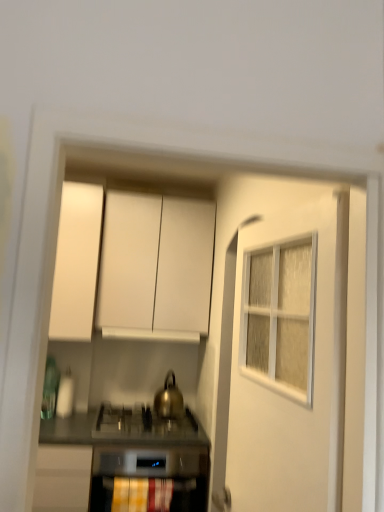
Describe the element at coordinates (76, 262) in the screenshot. This screenshot has height=512, width=384. I see `white matte cabinet at upper left, the 2th cabinetry in the right-to-left sequence` at that location.

This screenshot has height=512, width=384. Identify the location of white matte vent at center. (151, 335).

Image resolution: width=384 pixels, height=512 pixels. Describe the element at coordinates (290, 385) in the screenshot. I see `white textured door at center` at that location.

What do you see at coordinates (169, 399) in the screenshot?
I see `gold metallic kettle at center` at bounding box center [169, 399].

In order to face gold metallic kettle at center, should I rotate leftwards or rightwards?

Turn left by 2.668 degrees to look at gold metallic kettle at center.

Describe the element at coordinates (141, 495) in the screenshot. I see `yellow fabric curtain at lower center` at that location.

At what (x,y) coordinates should I click in order to perform the action: click on white matte cabinet at upper center, the second cabinetry when ordered from left to right. Please return your answer as a coordinate pair (x, y). The width and height of the screenshot is (384, 512). Looking at the image, I should click on (155, 267).

Identify the location of white matte cabinet at upper left, positioned as the first cabinetry in left-to-right order. (76, 262).

Considering the sizes of objects gold metallic kettle at center and white matte cabinet at upper left, positioned as the first cabinetry in left-to-right order, in the image provided, who is shorter, gold metallic kettle at center or white matte cabinet at upper left, positioned as the first cabinetry in left-to-right order,?

Standing shorter between the two is gold metallic kettle at center.

Is gold metallic kettle at center thinner than white matte cabinet at upper left, positioned as the first cabinetry in left-to-right order?

Indeed, gold metallic kettle at center has a lesser width compared to white matte cabinet at upper left, positioned as the first cabinetry in left-to-right order.

How different are the orientations of gold metallic kettle at center and white matte cabinet at upper left, the 2th cabinetry in the right-to-left sequence, in degrees?

They differ by 0.623 degrees in their facing directions.

The width and height of the screenshot is (384, 512). Find the location of `the 2nd cabinetry in front of the gold metallic kettle at center`. the 2nd cabinetry in front of the gold metallic kettle at center is located at coordinates (76, 262).

Looking at this image, considering the sizes of objects metallic stainless steel countertop at center and white matte cabinet at upper center, the second cabinetry when ordered from left to right, in the image provided, who is wider, metallic stainless steel countertop at center or white matte cabinet at upper center, the second cabinetry when ordered from left to right,?

metallic stainless steel countertop at center.

Does metallic stainless steel countertop at center have a greater height compared to white matte cabinet at upper center, the second cabinetry when ordered from left to right?

In fact, metallic stainless steel countertop at center may be shorter than white matte cabinet at upper center, the second cabinetry when ordered from left to right.

Who is bigger, metallic stainless steel countertop at center or white matte cabinet at upper center, arranged as the 1th cabinetry when viewed from the right?

With larger size is white matte cabinet at upper center, arranged as the 1th cabinetry when viewed from the right.

Could you measure the distance between metallic stainless steel countertop at center and white matte cabinet at upper center, arranged as the 1th cabinetry when viewed from the right?

The distance of metallic stainless steel countertop at center from white matte cabinet at upper center, arranged as the 1th cabinetry when viewed from the right, is 85.52 centimeters.

Find the location of `vent above the stainless steel oven at center (from a real-world perspective)`. vent above the stainless steel oven at center (from a real-world perspective) is located at coordinates (151, 335).

From a real-world perspective, relative to white matte vent at center, is stainless steel oven at center vertically above or below?

stainless steel oven at center is below white matte vent at center.

Could white matte vent at center be considered to be inside stainless steel oven at center?

No.

Can you tell me how much stainless steel oven at center and white matte vent at center differ in facing direction?

stainless steel oven at center and white matte vent at center are facing 1.24 degrees away from each other.

Looking at the image, does metallic stainless steel countertop at center seem bigger or smaller compared to white matte vent at center?

Considering their sizes, metallic stainless steel countertop at center takes up more space than white matte vent at center.

In the scene shown: Is metallic stainless steel countertop at center inside or outside of white matte vent at center?

metallic stainless steel countertop at center is spatially situated outside white matte vent at center.

The height and width of the screenshot is (512, 384). I want to click on countertop below the white matte vent at center (from a real-world perspective), so pyautogui.click(x=123, y=428).

Relative to gold metallic kettle at center, is yellow fabric curtain at lower center in front or behind?

yellow fabric curtain at lower center is in front of gold metallic kettle at center.

Consider the image. From the image's perspective, is yellow fabric curtain at lower center above gold metallic kettle at center?

No, from the image's perspective, yellow fabric curtain at lower center is not above gold metallic kettle at center.

Does yellow fabric curtain at lower center have a lesser height compared to gold metallic kettle at center?

Yes, yellow fabric curtain at lower center is shorter than gold metallic kettle at center.

From a real-world perspective, who is located lower, yellow fabric curtain at lower center or gold metallic kettle at center?

In real-world perspective, yellow fabric curtain at lower center is lower.

How many degrees apart are the facing directions of white matte cabinet at upper left, positioned as the first cabinetry in left-to-right order, and yellow fabric curtain at lower center?

The angular difference between white matte cabinet at upper left, positioned as the first cabinetry in left-to-right order, and yellow fabric curtain at lower center is 1.22 degrees.

Is yellow fabric curtain at lower center surrounded by white matte cabinet at upper left, positioned as the first cabinetry in left-to-right order?

No, yellow fabric curtain at lower center is not a part of white matte cabinet at upper left, positioned as the first cabinetry in left-to-right order.

Between point (88, 291) and point (131, 482), which one is positioned behind?

The point (88, 291) is farther from the camera.

Where is `cabinetry that is the 1st one when counting backward from the yellow fabric curtain at lower center`? cabinetry that is the 1st one when counting backward from the yellow fabric curtain at lower center is located at coordinates (76, 262).

Considering the points (238, 469) and (69, 221), which point is in front, point (238, 469) or point (69, 221)?

Point (238, 469)

Can you confirm if white textured door at center is shorter than white matte cabinet at upper left, positioned as the first cabinetry in left-to-right order?

No, white textured door at center is not shorter than white matte cabinet at upper left, positioned as the first cabinetry in left-to-right order.

Is white textured door at center to the left of white matte cabinet at upper left, positioned as the first cabinetry in left-to-right order, from the viewer's perspective?

In fact, white textured door at center is to the right of white matte cabinet at upper left, positioned as the first cabinetry in left-to-right order.

In terms of size, does white textured door at center appear bigger or smaller than white matte cabinet at upper left, positioned as the first cabinetry in left-to-right order?

Considering their sizes, white textured door at center takes up less space than white matte cabinet at upper left, positioned as the first cabinetry in left-to-right order.

Identify the location of kitchen appliance below the white matte cabinet at upper left, the 2th cabinetry in the right-to-left sequence (from the image's perspective). (169, 399).

Locate an element on the screen. This screenshot has width=384, height=512. countertop lying on the left of white matte cabinet at upper center, arranged as the 1th cabinetry when viewed from the right is located at coordinates (123, 428).

Based on their spatial positions, is white matte cabinet at upper center, the second cabinetry when ordered from left to right, or yellow fabric curtain at lower center closer to gold metallic kettle at center?

yellow fabric curtain at lower center.

Based on the photo, based on their spatial positions, is white matte cabinet at upper left, the 2th cabinetry in the right-to-left sequence, or white textured door at center further from gold metallic kettle at center?

The object further to gold metallic kettle at center is white matte cabinet at upper left, the 2th cabinetry in the right-to-left sequence.

From the image, which object appears to be farther from white textured door at center, white matte cabinet at upper left, positioned as the first cabinetry in left-to-right order, or gold metallic kettle at center?

The object further to white textured door at center is white matte cabinet at upper left, positioned as the first cabinetry in left-to-right order.

Considering their positions, is stainless steel oven at center positioned further to white textured door at center than white matte cabinet at upper center, the second cabinetry when ordered from left to right?

white matte cabinet at upper center, the second cabinetry when ordered from left to right.

Estimate the real-world distances between objects in this image. Which object is closer to yellow fabric curtain at lower center, stainless steel oven at center or white textured door at center?

Among the two, stainless steel oven at center is located nearer to yellow fabric curtain at lower center.

Looking at the image, which one is located closer to white matte cabinet at upper left, the 2th cabinetry in the right-to-left sequence, metallic stainless steel countertop at center or white matte vent at center?

white matte vent at center is positioned closer to the anchor white matte cabinet at upper left, the 2th cabinetry in the right-to-left sequence.

Which object lies nearer to the anchor point metallic stainless steel countertop at center, white matte cabinet at upper center, arranged as the 1th cabinetry when viewed from the right, or white matte cabinet at upper left, positioned as the first cabinetry in left-to-right order?

white matte cabinet at upper center, arranged as the 1th cabinetry when viewed from the right, lies closer to metallic stainless steel countertop at center than the other object.

Which object lies further to the anchor point white matte vent at center, yellow fabric curtain at lower center or white matte cabinet at upper left, the 2th cabinetry in the right-to-left sequence?

Based on the image, yellow fabric curtain at lower center appears to be further to white matte vent at center.

The image size is (384, 512). I want to click on kitchen appliance that lies between white matte vent at center and stainless steel oven at center from top to bottom, so click(169, 399).

Where is `kitchen appliance between white matte vent at center and metallic stainless steel countertop at center from top to bottom`? kitchen appliance between white matte vent at center and metallic stainless steel countertop at center from top to bottom is located at coordinates (169, 399).

Locate an element on the screen. The height and width of the screenshot is (512, 384). kitchen appliance between white matte cabinet at upper left, the 2th cabinetry in the right-to-left sequence, and metallic stainless steel countertop at center in the up-down direction is located at coordinates (169, 399).

Find the location of a particular element. Image resolution: width=384 pixels, height=512 pixels. countertop between white matte cabinet at upper left, the 2th cabinetry in the right-to-left sequence, and stainless steel oven at center, in the vertical direction is located at coordinates (123, 428).